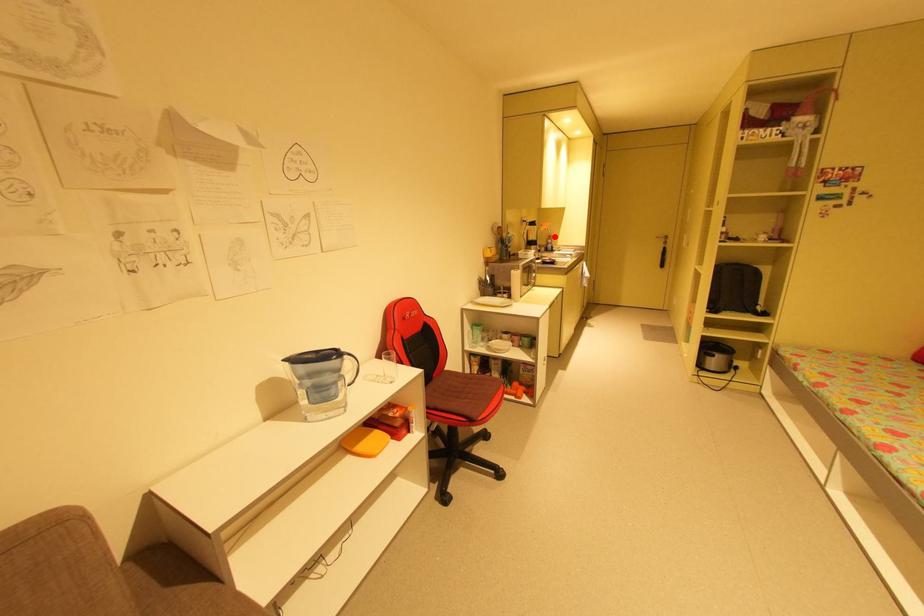
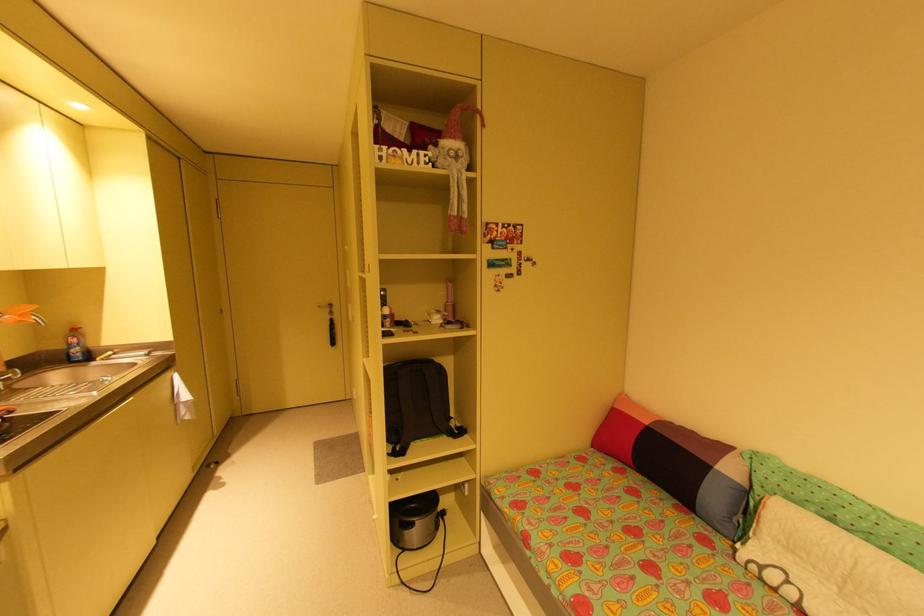
Question: I am providing you with two images of the same scene from different viewpoints. Image1 has a red point marked. In image2, the corresponding 3D location appears at what relative position? Reply with the corresponding letter.

Choices:
 (A) Closer
 (B) Farther

Answer: (B)